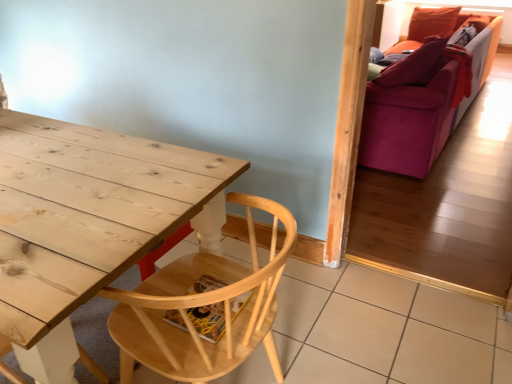
Question: Does natural wood chair at lower left have a lesser width compared to velvet purple couch at right?

Choices:
 (A) yes
 (B) no

Answer: (A)

Question: Is natural wood chair at lower left oriented towards velvet purple couch at right?

Choices:
 (A) yes
 (B) no

Answer: (B)

Question: Does natural wood chair at lower left have a larger size compared to velvet purple couch at right?

Choices:
 (A) no
 (B) yes

Answer: (A)

Question: Is natural wood chair at lower left to the left of velvet purple couch at right from the viewer's perspective?

Choices:
 (A) yes
 (B) no

Answer: (A)

Question: From a real-world perspective, is natural wood chair at lower left physically above velvet purple couch at right?

Choices:
 (A) no
 (B) yes

Answer: (A)

Question: Is natural wood chair at lower left further to the viewer compared to velvet purple couch at right?

Choices:
 (A) yes
 (B) no

Answer: (B)

Question: Is velvet purple couch at right taller than natural wood chair at lower left?

Choices:
 (A) yes
 (B) no

Answer: (A)

Question: Is the depth of velvet purple couch at right greater than that of natural wood chair at lower left?

Choices:
 (A) no
 (B) yes

Answer: (B)

Question: Is natural wood chair at lower left completely or partially inside velvet purple couch at right?

Choices:
 (A) yes
 (B) no

Answer: (B)

Question: From the image's perspective, is velvet purple couch at right above natural wood chair at lower left?

Choices:
 (A) yes
 (B) no

Answer: (A)

Question: Is velvet purple couch at right to the right of natural wood chair at lower left from the viewer's perspective?

Choices:
 (A) yes
 (B) no

Answer: (A)

Question: Is velvet purple couch at right not within natural wood chair at lower left?

Choices:
 (A) yes
 (B) no

Answer: (A)

Question: Is natural wood chair at lower left inside the boundaries of velvet purple couch at right, or outside?

Choices:
 (A) inside
 (B) outside

Answer: (B)